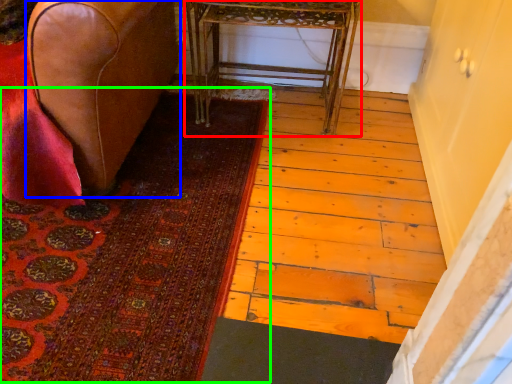
Question: Which object is the farthest from table (highlighted by a red box)? Choose among these: furniture (highlighted by a blue box) or mat (highlighted by a green box).

Choices:
 (A) furniture
 (B) mat

Answer: (B)